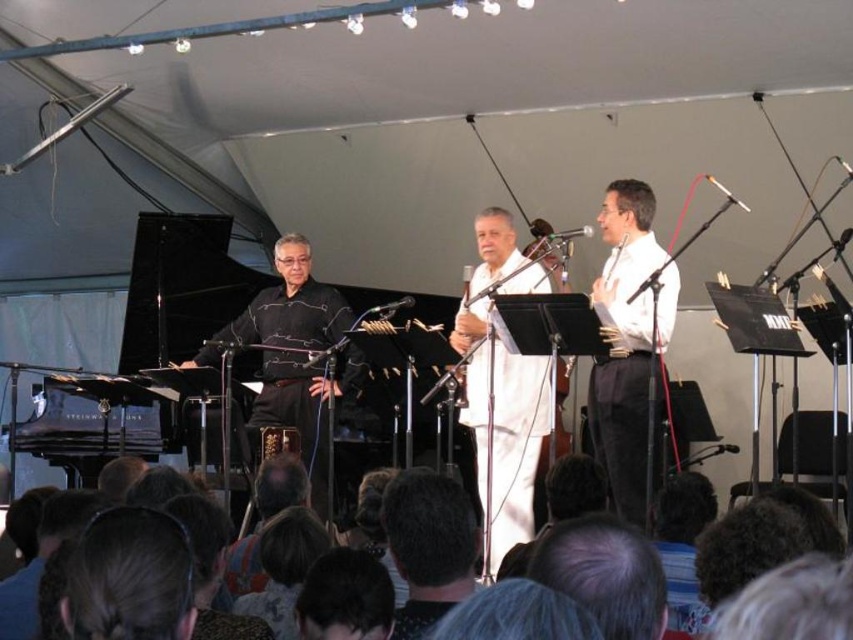
Based on the scene description, which object is taller between the white cotton conductor at center and the dark brown hair at lower center?

The white cotton conductor at center is taller than the dark brown hair at lower center according to the description.